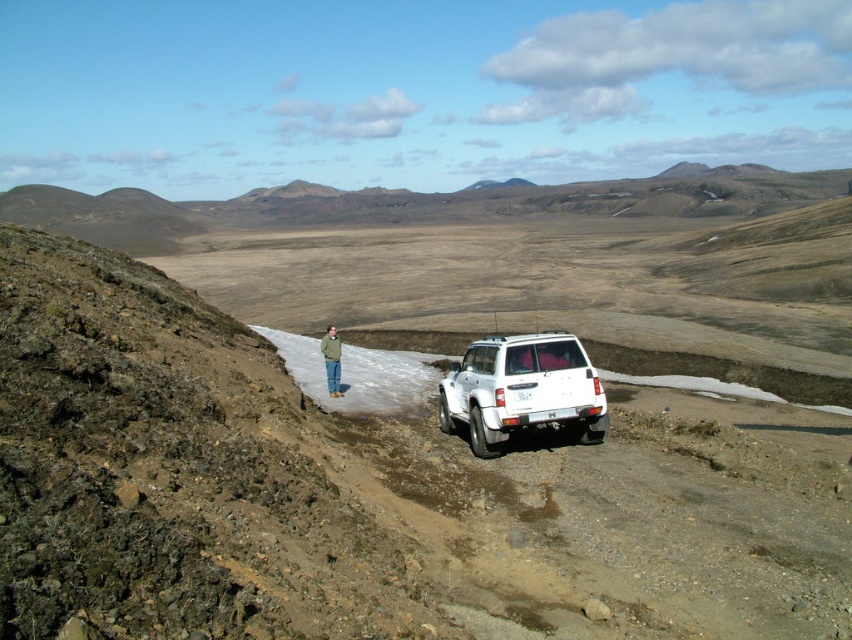
Question: Does white matte suv at center appear on the right side of green fabric jacket at center?

Choices:
 (A) yes
 (B) no

Answer: (A)

Question: Does white matte suv at center appear under green fabric jacket at center?

Choices:
 (A) no
 (B) yes

Answer: (A)

Question: Is white matte suv at center positioned behind green fabric jacket at center?

Choices:
 (A) yes
 (B) no

Answer: (B)